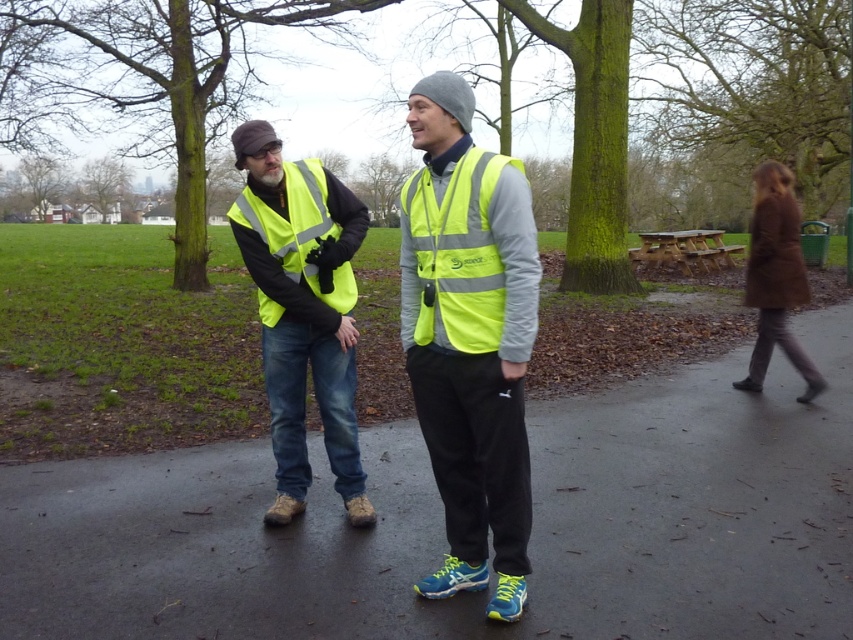
Can you confirm if neon yellow reflective vest at center is smaller than high-visibility fabric safety vest at center?

No.

Is neon yellow reflective vest at center below high-visibility fabric safety vest at center?

Yes, neon yellow reflective vest at center is below high-visibility fabric safety vest at center.

Is point (509, 461) in front of point (471, 301)?

No, it is not.

Image resolution: width=853 pixels, height=640 pixels. I want to click on neon yellow reflective vest at center, so click(x=469, y=339).

Between point (236, 138) and point (341, 224), which one is positioned in front?

Point (236, 138) is in front.

Where is `high visibility yellow vest at center`? high visibility yellow vest at center is located at coordinates (302, 310).

Where is `high visibility yellow vest at center`? This screenshot has height=640, width=853. high visibility yellow vest at center is located at coordinates (302, 310).

From the picture: Is high-visibility yellow safety vest at left above brown wool coat at right?

No, high-visibility yellow safety vest at left is not above brown wool coat at right.

Can you confirm if high-visibility yellow safety vest at left is bigger than brown wool coat at right?

No, high-visibility yellow safety vest at left is not bigger than brown wool coat at right.

Between point (306, 225) and point (759, 369), which one is positioned in front?

Point (306, 225) is more forward.

Where is `high-visibility yellow safety vest at left`? Image resolution: width=853 pixels, height=640 pixels. high-visibility yellow safety vest at left is located at coordinates (299, 243).